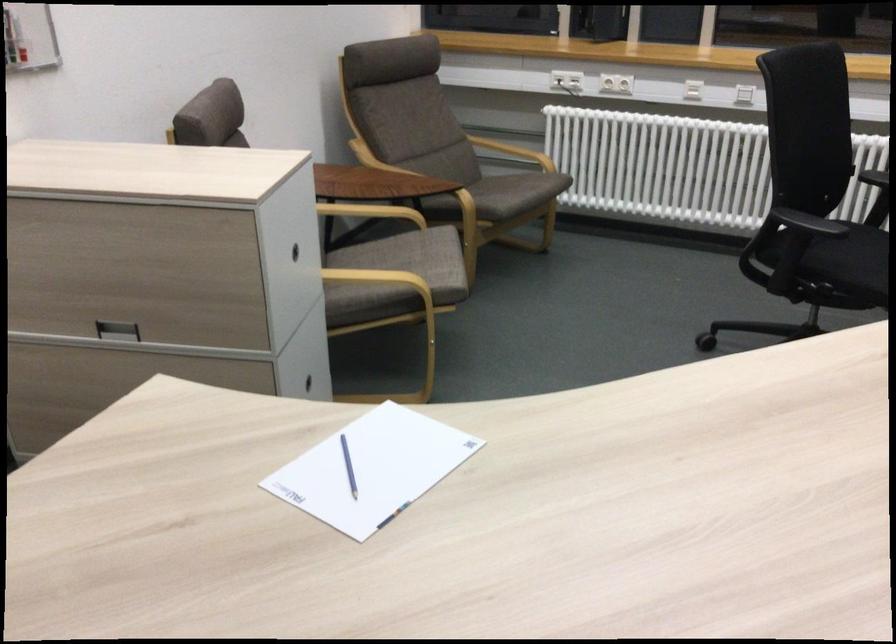
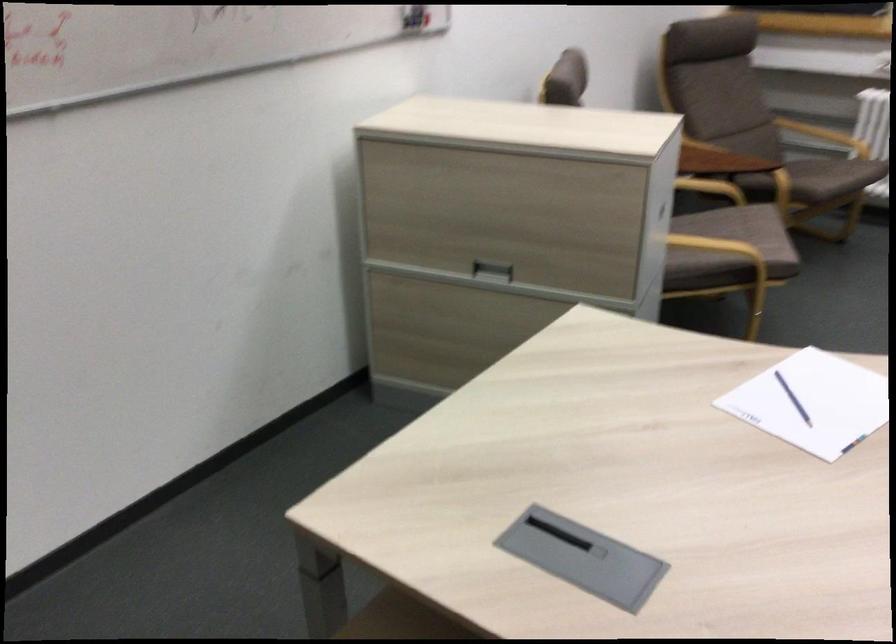
Find the pixel in the second image that matches (418,261) in the first image.

(746, 232)